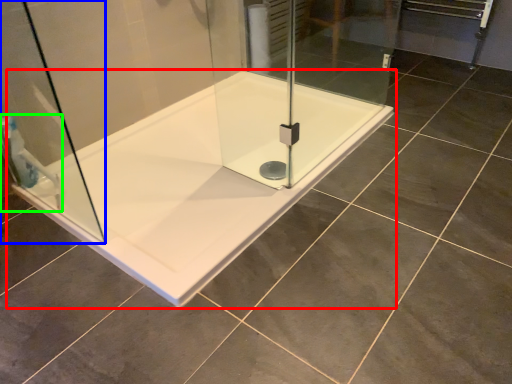
Question: Estimate the real-world distances between objects in this image. Which object is farther from bathtub (highlighted by a red box), shower door (highlighted by a blue box) or shower (highlighted by a green box)?

Choices:
 (A) shower door
 (B) shower

Answer: (B)